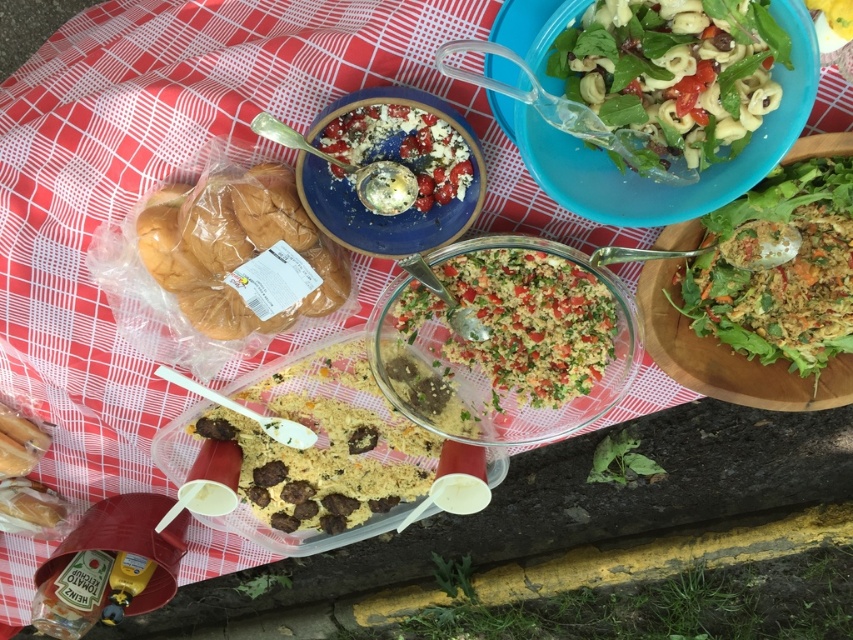
Can you confirm if green leafy salad at upper right is wider than green crumbly salad at center?

Incorrect, green leafy salad at upper right's width does not surpass green crumbly salad at center's.

Between point (625, 40) and point (474, 346), which one is positioned in front?

Positioned in front is point (625, 40).

The width and height of the screenshot is (853, 640). Identify the location of green leafy salad at upper right. (674, 72).

Does green crumbly salad at center appear on the right side of matte blue plate with salad at upper center?

Yes, green crumbly salad at center is to the right of matte blue plate with salad at upper center.

Between point (482, 291) and point (439, 145), which one is positioned behind?

Positioned behind is point (482, 291).

Find the location of a particular element. This screenshot has width=853, height=640. green crumbly salad at center is located at coordinates (521, 323).

Who is more forward, (236, 428) or (779, 323)?

Point (779, 323) is more forward.

Who is more distant from viewer, (358, 369) or (792, 304)?

The point (358, 369) is behind.

You are a GUI agent. You are given a task and a screenshot of the screen. Output one action in this format:
    pyautogui.click(x=<x>, y=<y>)
    Task: Click on the brown crumbly mix at center
    This screenshot has width=853, height=640.
    Given the screenshot: What is the action you would take?
    pyautogui.click(x=323, y=445)